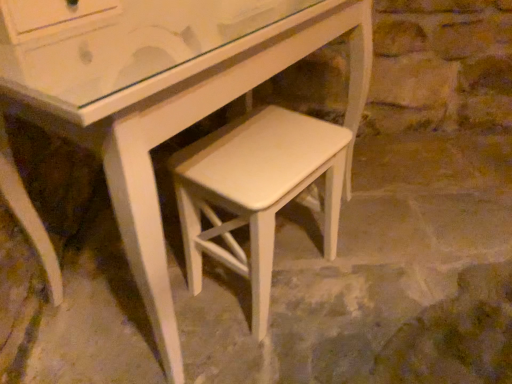
This screenshot has width=512, height=384. What are the coordinates of `free space above white matte stool at center (from a real-world perspective)` in the screenshot? It's located at (263, 150).